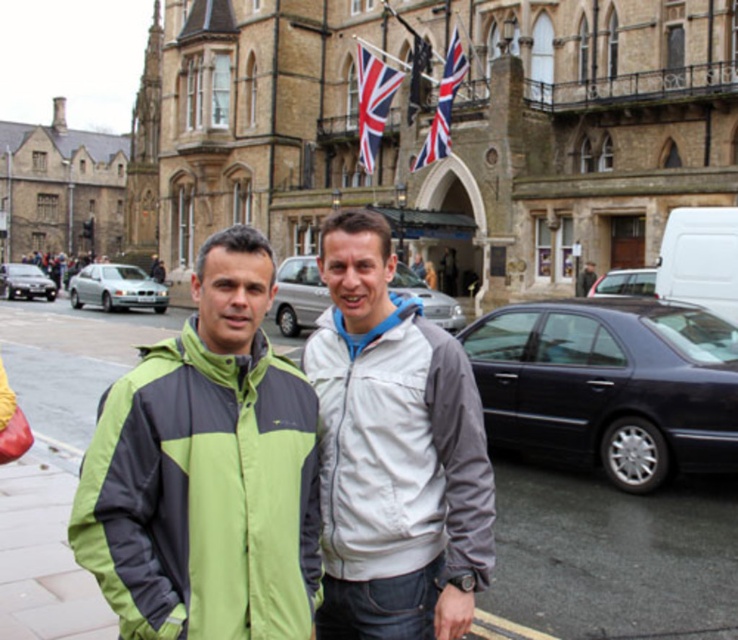
You are a tour guide leading a group near the historic building. You want to point out the silver metallic sedan at center and the satin silver metallic sedan at left to your group. Can you see both sedans clearly from your current position?

Yes, because the silver metallic sedan at center is in front of the satin silver metallic sedan at left, so both are visible from your position.